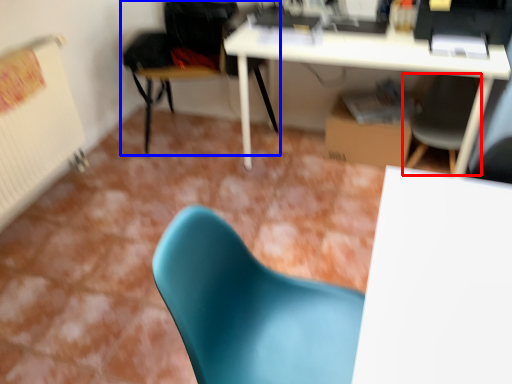
Question: Which point is further to the camera, chair (highlighted by a red box) or chair (highlighted by a blue box)?

Choices:
 (A) chair
 (B) chair

Answer: (B)